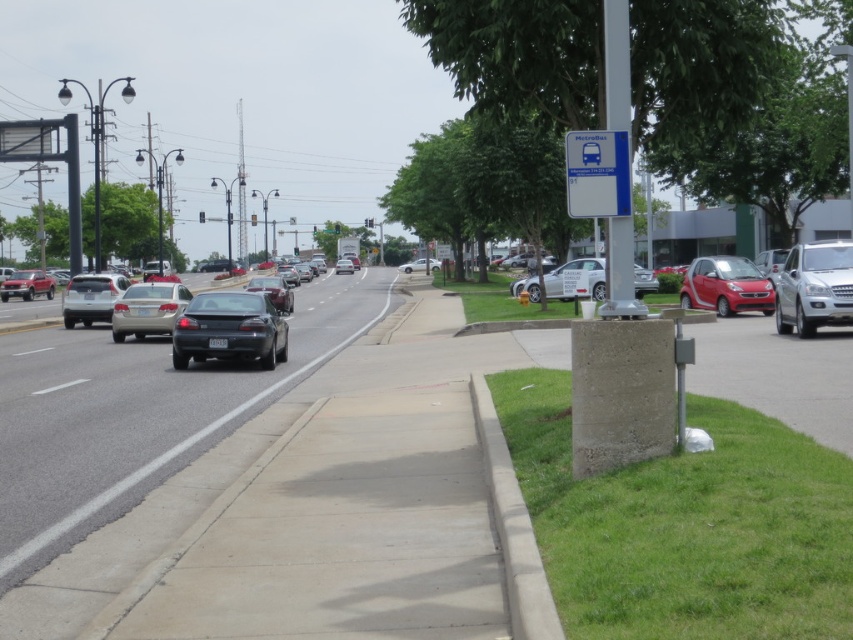
You are standing at the intersection looking down the street. There are two points marked on the road ahead. The first point is at coordinates point (582, 134) and the second point is at point (114, 291). Which of these two points is closer to your current position?

Point (582, 134) is closer to the camera than point (114, 291), so the first point is closer to your current position.

You are a pedestrian trying to reach the bus stop. You see the blue plastic bus stop sign at upper right and the satin silver suv at left. Which object is closer to your current position?

The blue plastic bus stop sign at upper right is smaller than the satin silver suv at left, so the satin silver suv at left is closer to you.

You are standing at the intersection and looking at the two points marked in the image. Which point, point [572,184] or point [758,284], is closer to you?

Point [572,184] is closer to the camera than point [758,284].